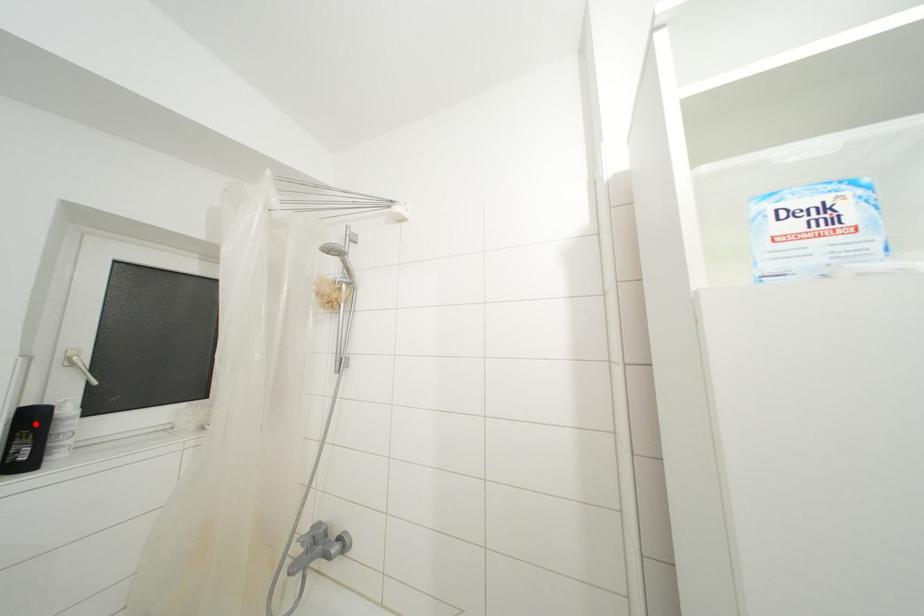
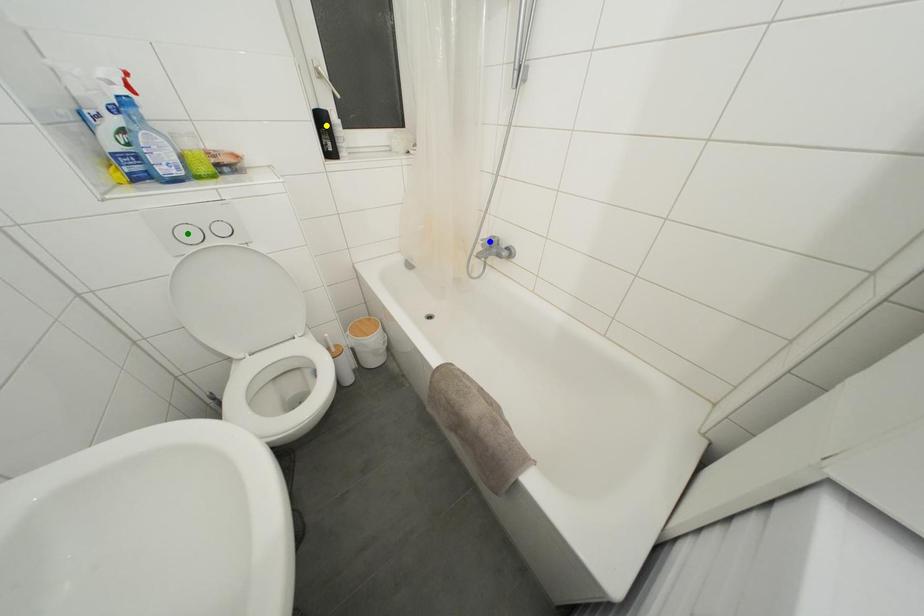
Question: I am providing you with two images of the same scene from different viewpoints. A red point is marked on the first image. You are given multiple points on the second image. In image 2, which mark is for the same physical point as the one in image 1?

Choices:
 (A) yellow point
 (B) green point
 (C) blue point

Answer: (A)